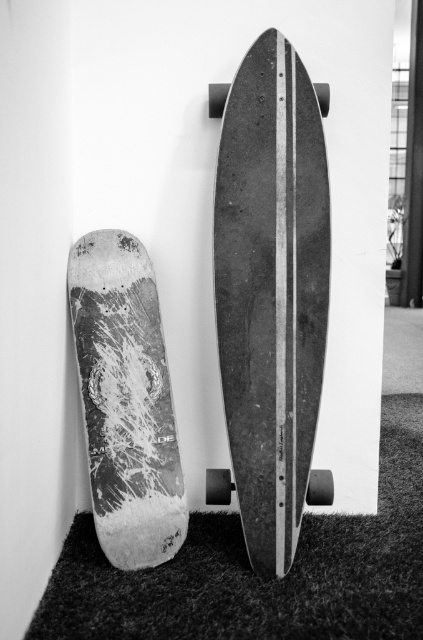
You are a photographer standing in front of the skateboards. You need to place a small sticker exactly at the center point of the smooth wood skateboard at center. According to the coordinates provided, where should you place the sticker?

The sticker should be placed at the coordinates point (x=271, y=291), which is the center of the smooth wood skateboard at center.

You are a skateboarder who wants to place a new sticker on your speckled wood skateboard at left. You notice the textured carpet at lower center nearby. If you place the sticker on the skateboard while it is resting on the carpet, will the carpet interfere with the placement?

The textured carpet at lower center is positioned under the speckled wood skateboard at left, so placing the sticker while it rests on the carpet may cause uneven adhesion or difficulty positioning due to the carpet fibers interfering with the sticker placement.

You are a skateboarder trying to choose between the smooth wood skateboard at center and the speckled wood skateboard at left based on their sizes. Which one is bigger?

The speckled wood skateboard at left is bigger than the smooth wood skateboard at center.